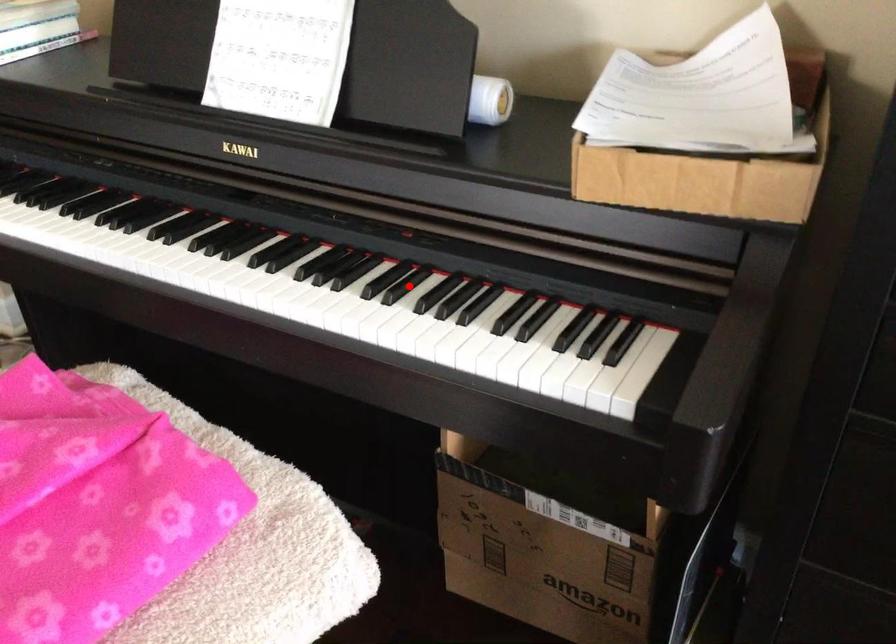
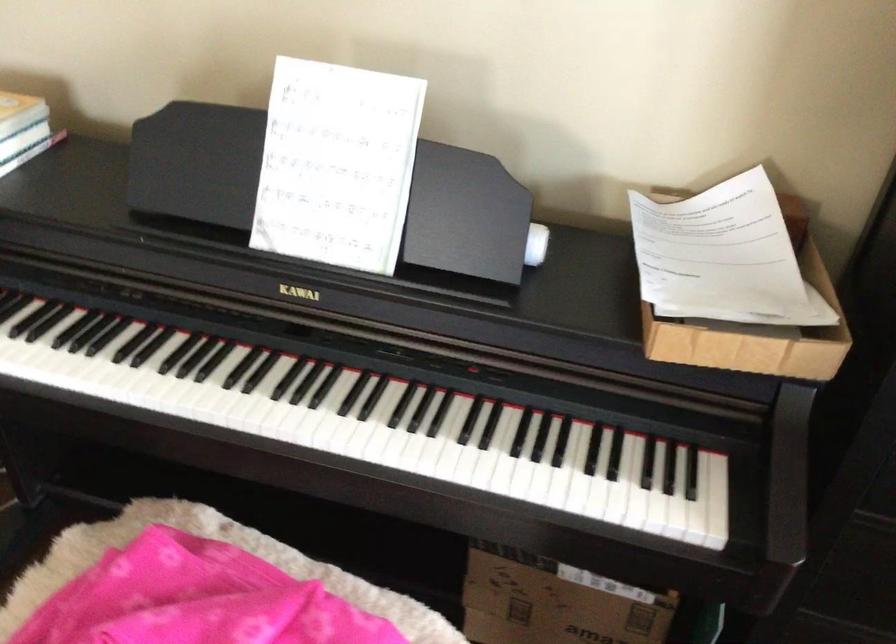
Question: I am providing you with two images of the same scene from different viewpoints. Given a red point in image1, look at the same physical point in image2. Is it:

Choices:
 (A) Closer to the viewpoint
 (B) Farther from the viewpoint

Answer: (B)